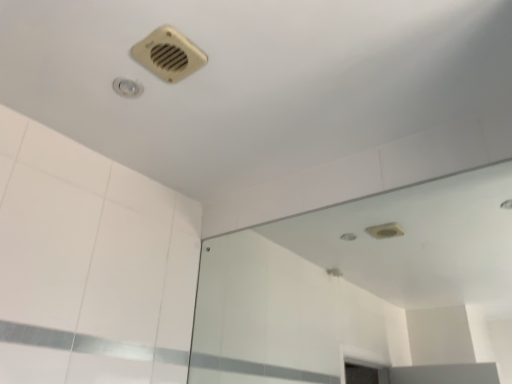
Question: In the image, is transparent glass mirror at upper center positioned in front of or behind beige plastic air conditioning at upper center?

Choices:
 (A) behind
 (B) front

Answer: (B)

Question: From the image's perspective, is transparent glass mirror at upper center located above or below beige plastic air conditioning at upper center?

Choices:
 (A) above
 (B) below

Answer: (B)

Question: Considering the positions of transparent glass mirror at upper center and beige plastic air conditioning at upper center in the image, is transparent glass mirror at upper center taller or shorter than beige plastic air conditioning at upper center?

Choices:
 (A) short
 (B) tall

Answer: (B)

Question: Choose the correct answer: Is beige plastic air conditioning at upper center inside transparent glass mirror at upper center or outside it?

Choices:
 (A) inside
 (B) outside

Answer: (B)

Question: In terms of height, does beige plastic air conditioning at upper center look taller or shorter compared to transparent glass mirror at upper center?

Choices:
 (A) tall
 (B) short

Answer: (B)

Question: Is beige plastic air conditioning at upper center to the left or to the right of transparent glass mirror at upper center in the image?

Choices:
 (A) left
 (B) right

Answer: (A)

Question: From the image's perspective, relative to transparent glass mirror at upper center, is beige plastic air conditioning at upper center above or below?

Choices:
 (A) below
 (B) above

Answer: (B)